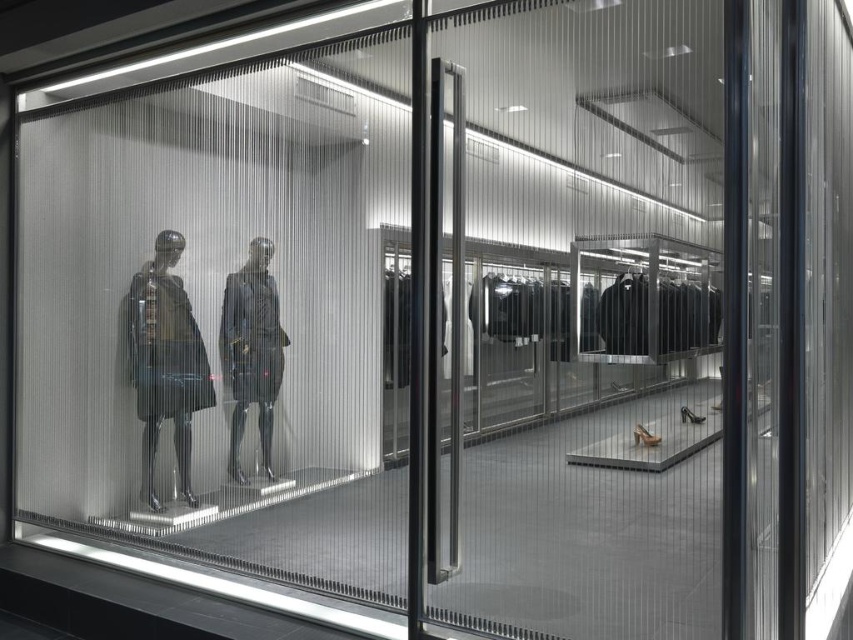
You are standing in front of the store window and see two points marked on the glass. The first point is at coordinate point (178, 125) and the second is at point (128, 308). Which point appears closer to you?

Point (178, 125) is closer to the camera than point (128, 308), so the first point appears closer to you.

You are a customer in the store and want to see both the matte black dress at left and the matte black suit at center. Which one is closer to the glass window with the vertical blind pattern?

The matte black dress at left is positioned under the matte black suit at center, so the dress is closer to the glass window since it is below the suit.

You are a customer looking to purchase a suit. You see the transparent plastic mannequins at left and the matte black suit at center in the store display. Which object is bigger?

The transparent plastic mannequins at left are larger in size compared to the matte black suit at center.